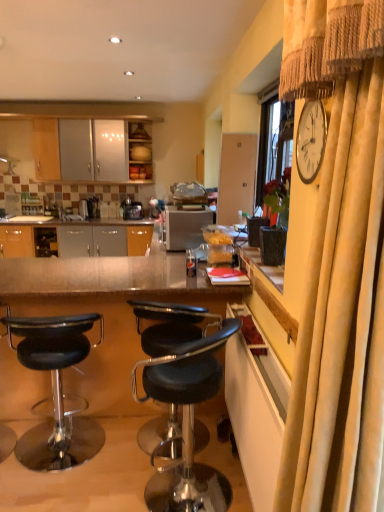
What do you see at coordinates (56, 390) in the screenshot?
I see `black leather stool at lower left, arranged as the 1th chair when viewed from the left` at bounding box center [56, 390].

The image size is (384, 512). Identify the location of black leather stool at lower left, placed as the 2th chair when sorted from right to left. (56, 390).

Find the location of a particular element. Image resolution: width=384 pixels, height=512 pixels. black leather stool at lower right, marked as the second chair in a left-to-right arrangement is located at coordinates (187, 423).

The image size is (384, 512). In order to click on satin black coffee machine at center, placed as the second coffee machine when sorted from right to left in this screenshot , I will do `click(89, 208)`.

Where is `satin black coffee machine at center, acting as the 2th coffee machine starting from the left`? satin black coffee machine at center, acting as the 2th coffee machine starting from the left is located at coordinates (131, 209).

Describe the element at coordinates (341, 276) in the screenshot. I see `velvet beige curtain at right` at that location.

The image size is (384, 512). I want to click on black leather stool at lower left, placed as the 2th chair when sorted from right to left, so click(56, 390).

Is satin silver toaster at center inside the boundaries of black leather stool at lower right, marked as the second chair in a left-to-right arrangement, or outside?

satin silver toaster at center exists outside the volume of black leather stool at lower right, marked as the second chair in a left-to-right arrangement.

Which object is more forward, satin silver toaster at center or black leather stool at lower right, marked as the second chair in a left-to-right arrangement?

black leather stool at lower right, marked as the second chair in a left-to-right arrangement, is closer to the camera.

Which object is positioned more to the left, satin silver toaster at center or black leather stool at lower right, marked as the second chair in a left-to-right arrangement?

black leather stool at lower right, marked as the second chair in a left-to-right arrangement, is more to the left.

Considering the sizes of satin silver toaster at center and black leather stool at lower right, marked as the second chair in a left-to-right arrangement, in the image, is satin silver toaster at center bigger or smaller than black leather stool at lower right, marked as the second chair in a left-to-right arrangement,?

In the image, satin silver toaster at center appears to be smaller than black leather stool at lower right, marked as the second chair in a left-to-right arrangement.

Is satin silver toaster at center thinner than velvet beige curtain at right?

In fact, satin silver toaster at center might be wider than velvet beige curtain at right.

From a real-world perspective, which is physically below, satin silver toaster at center or velvet beige curtain at right?

In real-world perspective, satin silver toaster at center is lower.

Considering the sizes of satin silver toaster at center and velvet beige curtain at right in the image, is satin silver toaster at center bigger or smaller than velvet beige curtain at right?

In the image, satin silver toaster at center appears to be smaller than velvet beige curtain at right.

From the image's perspective, is satin silver toaster at center located above or below velvet beige curtain at right?

satin silver toaster at center is above velvet beige curtain at right.

Find the location of a particular element. The image size is (384, 512). cabinetry that appears above the satin black coffee machine at center, placed as the second coffee machine when sorted from right to left (from a real-world perspective) is located at coordinates (139, 152).

Which of these two, wooden cabinet at upper center, marked as the first cabinetry in a back-to-front arrangement, or satin black coffee machine at center, placed as the second coffee machine when sorted from right to left, stands shorter?

satin black coffee machine at center, placed as the second coffee machine when sorted from right to left, is shorter.

Can satin black coffee machine at center, placed as the 1th coffee machine when sorted from left to right, be found inside wooden cabinet at upper center, the second cabinetry in the front-to-back sequence?

Definitely not — satin black coffee machine at center, placed as the 1th coffee machine when sorted from left to right, is not inside wooden cabinet at upper center, the second cabinetry in the front-to-back sequence.

From the picture: Between wooden cabinet at upper center, marked as the first cabinetry in a back-to-front arrangement, and satin black coffee machine at center, placed as the 1th coffee machine when sorted from left to right, which one has smaller size?

satin black coffee machine at center, placed as the 1th coffee machine when sorted from left to right.

You are a GUI agent. You are given a task and a screenshot of the screen. Output one action in this format:
    pyautogui.click(x=<x>, y=<y>)
    Task: Click on the curtain above the metallic/reflective table at center (from a real-world perspective)
    The height and width of the screenshot is (512, 384).
    Given the screenshot: What is the action you would take?
    pyautogui.click(x=341, y=276)

Between velvet beige curtain at right and metallic/reflective table at center, which one appears on the left side from the viewer's perspective?

metallic/reflective table at center.

Can you tell me how much velvet beige curtain at right and metallic/reflective table at center differ in facing direction?

The angle between the facing direction of velvet beige curtain at right and the facing direction of metallic/reflective table at center is 91.5 degrees.

Is velvet beige curtain at right behind metallic/reflective table at center?

No, the depth of velvet beige curtain at right is less than that of metallic/reflective table at center.

In the scene shown: Which of these two, satin black coffee machine at center, placed as the second coffee machine when sorted from right to left, or black leather stool at lower left, arranged as the 1th chair when viewed from the left, stands shorter?

Standing shorter between the two is satin black coffee machine at center, placed as the second coffee machine when sorted from right to left.

Looking at this image, from the image's perspective, is satin black coffee machine at center, placed as the 1th coffee machine when sorted from left to right, beneath black leather stool at lower left, arranged as the 1th chair when viewed from the left?

No.

Is satin black coffee machine at center, placed as the 1th coffee machine when sorted from left to right, inside the boundaries of black leather stool at lower left, arranged as the 1th chair when viewed from the left, or outside?

satin black coffee machine at center, placed as the 1th coffee machine when sorted from left to right, exists outside the volume of black leather stool at lower left, arranged as the 1th chair when viewed from the left.

From a real-world perspective, which object stands above the other?

In real-world perspective, satin black coffee machine at center, placed as the 1th coffee machine when sorted from left to right, is above.

From the image's perspective, which is below, yellow wood cabinet at right, arranged as the 1th cabinetry when viewed from the right, or velvet beige curtain at right?

yellow wood cabinet at right, arranged as the 1th cabinetry when viewed from the right, appears lower in the image.

Is velvet beige curtain at right located within yellow wood cabinet at right, arranged as the 1th cabinetry when viewed from the right?

No, velvet beige curtain at right is located outside of yellow wood cabinet at right, arranged as the 1th cabinetry when viewed from the right.

Which is more to the left, yellow wood cabinet at right, positioned as the 1th cabinetry in bottom-to-top order, or velvet beige curtain at right?

yellow wood cabinet at right, positioned as the 1th cabinetry in bottom-to-top order.

Does point (145, 151) lie in front of point (141, 205)?

Yes, point (145, 151) is closer to viewer.

Who is taller, wooden cabinet at upper center, the second cabinetry in the front-to-back sequence, or satin black coffee machine at center, acting as the 2th coffee machine starting from the left?

wooden cabinet at upper center, the second cabinetry in the front-to-back sequence.

Based on the photo, between wooden cabinet at upper center, which ranks as the 2th cabinetry in right-to-left order, and satin black coffee machine at center, marked as the 1th coffee machine in a right-to-left arrangement, which one has larger size?

wooden cabinet at upper center, which ranks as the 2th cabinetry in right-to-left order, is bigger.

Based on the photo, how many degrees apart are the facing directions of wooden cabinet at upper center, the 1th cabinetry when ordered from top to bottom, and satin black coffee machine at center, acting as the 2th coffee machine starting from the left?

There is a 0.7-degree angle between the facing directions of wooden cabinet at upper center, the 1th cabinetry when ordered from top to bottom, and satin black coffee machine at center, acting as the 2th coffee machine starting from the left.

Find the location of a particular element. The width and height of the screenshot is (384, 512). appliance that appears behind the black leather stool at lower right, marked as the second chair in a left-to-right arrangement is located at coordinates (186, 228).

Find the location of a particular element. The image size is (384, 512). appliance above the velvet beige curtain at right (from the image's perspective) is located at coordinates (186, 228).

From the image, which object appears to be nearer to satin black coffee machine at center, placed as the 1th coffee machine when sorted from left to right, black leather stool at lower right, marked as the second chair in a left-to-right arrangement, or wooden cabinet at upper center, the 1th cabinetry when ordered from top to bottom?

wooden cabinet at upper center, the 1th cabinetry when ordered from top to bottom.

Which object lies nearer to the anchor point metallic/reflective table at center, velvet beige curtain at right or black leather stool at lower right, marked as the second chair in a left-to-right arrangement?

black leather stool at lower right, marked as the second chair in a left-to-right arrangement, is positioned closer to the anchor metallic/reflective table at center.

When comparing their distances from satin black coffee machine at center, placed as the 1th coffee machine when sorted from left to right, does velvet beige curtain at right or yellow wood cabinet at right, the 2th cabinetry viewed from the left, seem further?

velvet beige curtain at right lies further to satin black coffee machine at center, placed as the 1th coffee machine when sorted from left to right, than the other object.

When comparing their distances from satin black coffee machine at center, placed as the second coffee machine when sorted from right to left, does wooden cabinet at upper center, the 1th cabinetry when ordered from top to bottom, or yellow wood cabinet at right, the 2th cabinetry viewed from the left, seem closer?

wooden cabinet at upper center, the 1th cabinetry when ordered from top to bottom, lies closer to satin black coffee machine at center, placed as the second coffee machine when sorted from right to left, than the other object.

Which object lies further to the anchor point yellow wood cabinet at right, the 2th cabinetry viewed from the left, black leather stool at lower left, placed as the 2th chair when sorted from right to left, or satin black coffee machine at center, acting as the 2th coffee machine starting from the left?

satin black coffee machine at center, acting as the 2th coffee machine starting from the left.

From the picture: Based on their spatial positions, is yellow wood cabinet at right, positioned as the 1th cabinetry in bottom-to-top order, or satin black coffee machine at center, placed as the second coffee machine when sorted from right to left, closer to velvet beige curtain at right?

The object closer to velvet beige curtain at right is yellow wood cabinet at right, positioned as the 1th cabinetry in bottom-to-top order.

In the scene shown: Looking at the image, which one is located further to black leather stool at lower right, marked as the second chair in a left-to-right arrangement, satin black coffee machine at center, placed as the 1th coffee machine when sorted from left to right, or wooden cabinet at upper center, which is the second cabinetry in bottom-to-top order?

The object further to black leather stool at lower right, marked as the second chair in a left-to-right arrangement, is wooden cabinet at upper center, which is the second cabinetry in bottom-to-top order.

From the image, which object appears to be nearer to satin silver toaster at center, black leather stool at lower left, arranged as the 1th chair when viewed from the left, or metallic/reflective table at center?

metallic/reflective table at center lies closer to satin silver toaster at center than the other object.

Where is `appliance between metallic/reflective table at center and satin black coffee machine at center, acting as the 2th coffee machine starting from the left, along the z-axis`? This screenshot has width=384, height=512. appliance between metallic/reflective table at center and satin black coffee machine at center, acting as the 2th coffee machine starting from the left, along the z-axis is located at coordinates (186, 228).

Image resolution: width=384 pixels, height=512 pixels. Identify the location of table situated between black leather stool at lower left, arranged as the 1th chair when viewed from the left, and yellow wood cabinet at right, positioned as the 1th cabinetry in bottom-to-top order, from left to right. (107, 312).

Locate an element on the screen. This screenshot has width=384, height=512. chair between velvet beige curtain at right and black leather stool at lower left, placed as the 2th chair when sorted from right to left, in the front-back direction is located at coordinates (187, 423).

Where is `cabinetry between black leather stool at lower left, placed as the 2th chair when sorted from right to left, and satin black coffee machine at center, placed as the 1th coffee machine when sorted from left to right, in the front-back direction`? The image size is (384, 512). cabinetry between black leather stool at lower left, placed as the 2th chair when sorted from right to left, and satin black coffee machine at center, placed as the 1th coffee machine when sorted from left to right, in the front-back direction is located at coordinates (139, 152).